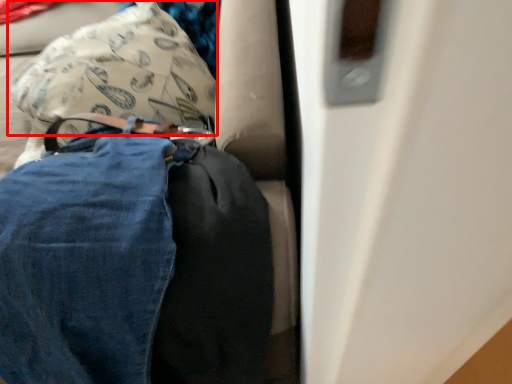
Question: From the image's perspective, where is pillow (annotated by the red box) located in relation to trousers in the image?

Choices:
 (A) above
 (B) below

Answer: (A)